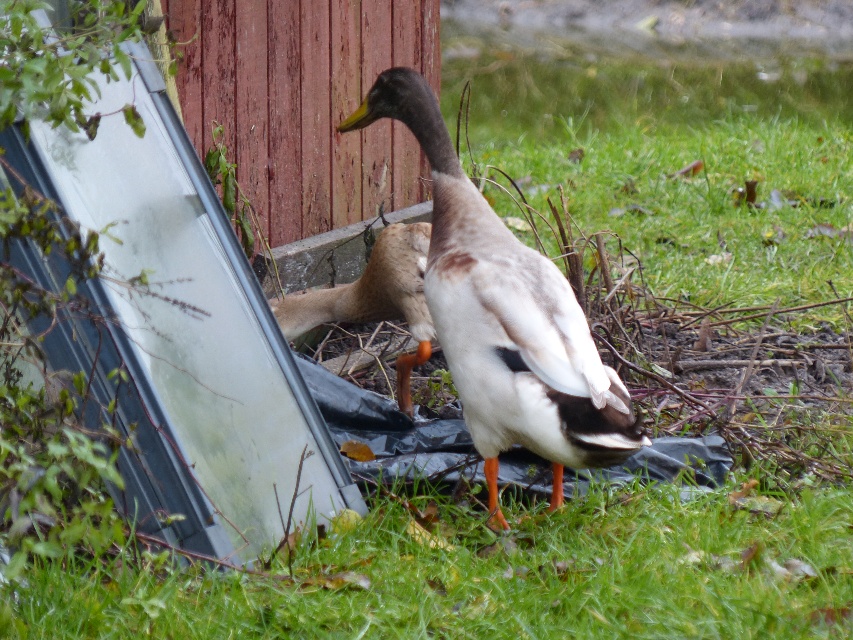
Which is behind, point (438, 214) or point (294, 323)?

Positioned behind is point (294, 323).

Between white matte duck at center and brown feathered duck at center, which one appears on the right side from the viewer's perspective?

Positioned to the right is white matte duck at center.

Does point (488, 225) come closer to viewer compared to point (384, 248)?

Yes, point (488, 225) is closer to viewer.

Where is `white matte duck at center`? The width and height of the screenshot is (853, 640). white matte duck at center is located at coordinates (505, 317).